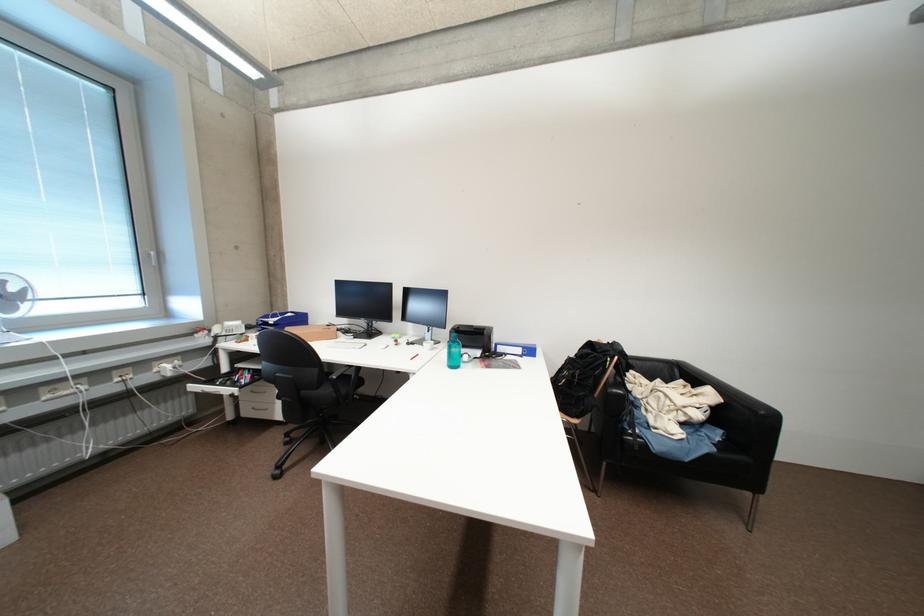
This screenshot has width=924, height=616. What are the coordinates of `sofa armrest` in the screenshot? It's located at (739, 416).